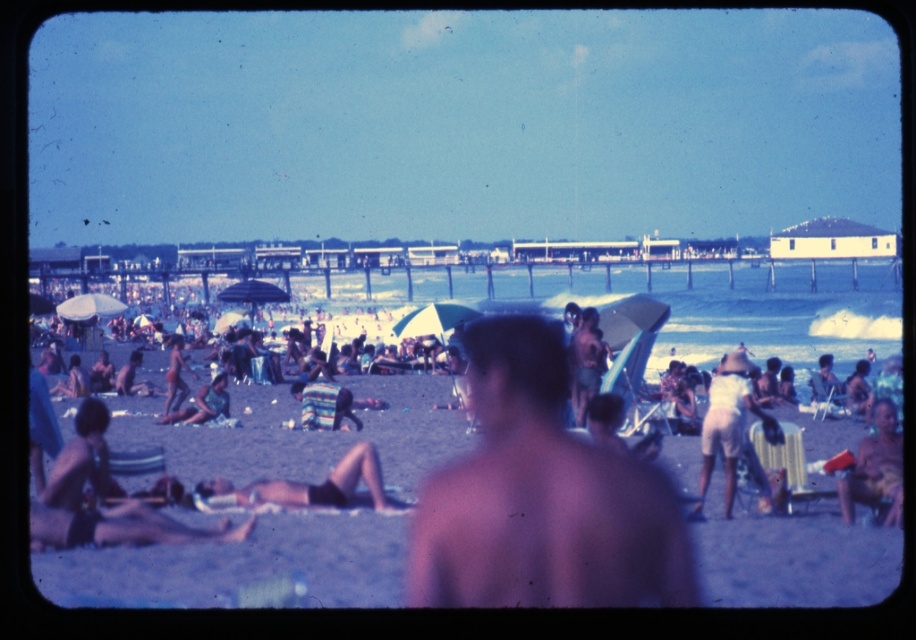
Question: Is orange fabric shorts at lower right above light blue fabric bikini at center?

Choices:
 (A) yes
 (B) no

Answer: (B)

Question: Which of the following is the closest to the observer?

Choices:
 (A) click(x=333, y=429)
 (B) click(x=271, y=490)

Answer: (B)

Question: Which of the following is the closest to the observer?

Choices:
 (A) (296, 499)
 (B) (453, 564)

Answer: (B)

Question: Does light blue fabric bikini at center appear under tan skin person at center?

Choices:
 (A) no
 (B) yes

Answer: (B)

Question: Can you confirm if matte white umbrella at center is positioned below orange fabric shorts at lower right?

Choices:
 (A) no
 (B) yes

Answer: (A)

Question: Estimate the real-world distances between objects in this image. Which object is closer to the orange fabric shorts at lower right?

Choices:
 (A) tan skin person at center
 (B) striped fabric towel at center
 (C) light blue fabric bikini at center
 (D) white striped fabric umbrella at center

Answer: (B)